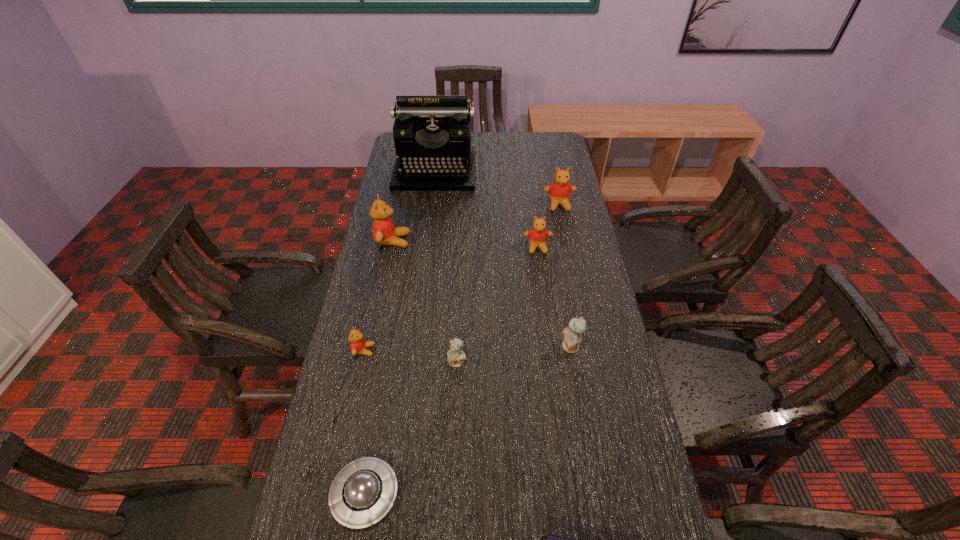
At what (x,y) coordinates should I click in order to perform the action: click on object that stands as the fifth closest to the smallest red teddy bear. Please return your answer as a coordinate pair (x, y). Image resolution: width=960 pixels, height=540 pixels. Looking at the image, I should click on (538, 234).

Identify the location of object that is the fifth closest to the left blue teddy bear. (384, 231).

This screenshot has height=540, width=960. Identify the location of teddy bear that is the fourth closest to the third biggest red teddy bear. (455, 357).

Choose which teddy bear is the second nearest neighbor to the saucer. Please provide its 2D coordinates. Your answer should be formatted as a tuple, i.e. [(x, y)], where the tuple contains the x and y coordinates of a point satisfying the conditions above.

[(358, 346)]

Identify which red teddy bear is located as the third nearest to the black typewriter. Please provide its 2D coordinates. Your answer should be formatted as a tuple, i.e. [(x, y)], where the tuple contains the x and y coordinates of a point satisfying the conditions above.

[(538, 234)]

Identify which red teddy bear is located as the fourth nearest to the blue book. Please provide its 2D coordinates. Your answer should be formatted as a tuple, i.e. [(x, y)], where the tuple contains the x and y coordinates of a point satisfying the conditions above.

[(559, 192)]

Locate an element on the screen. This screenshot has width=960, height=540. free spot that satisfies the following two spatial constraints: 1. on the front-facing side of the second nearest object; 2. on the right side of the smallest red teddy bear is located at coordinates (332, 495).

The height and width of the screenshot is (540, 960). Identify the location of vacant region that satisfies the following two spatial constraints: 1. on the front-facing side of the fifth shortest teddy bear; 2. on the front-facing side of the nearest red teddy bear. (589, 350).

Identify the location of free point that satisfies the following two spatial constraints: 1. on the typing side of the tallest object; 2. on the front-facing side of the second tallest object. Image resolution: width=960 pixels, height=540 pixels. (426, 241).